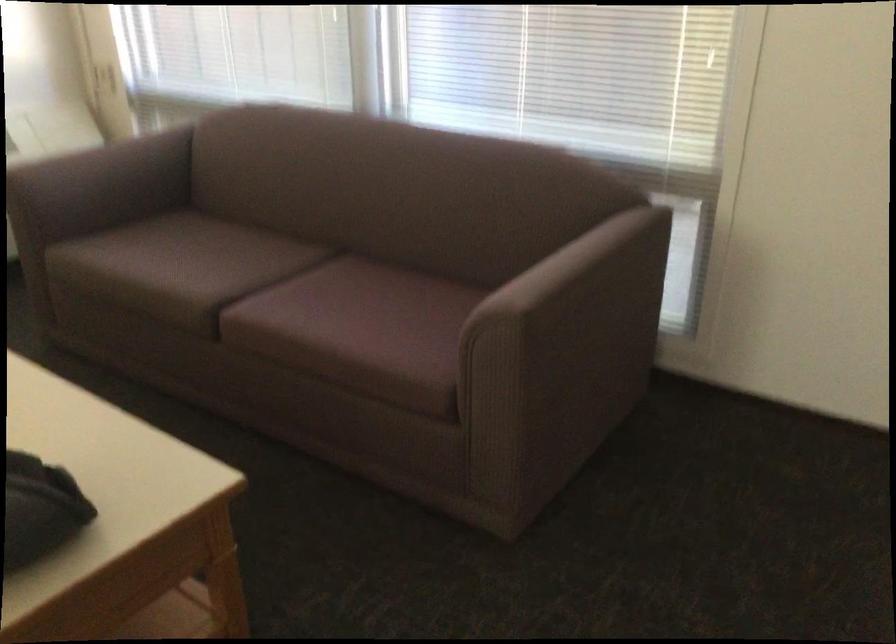
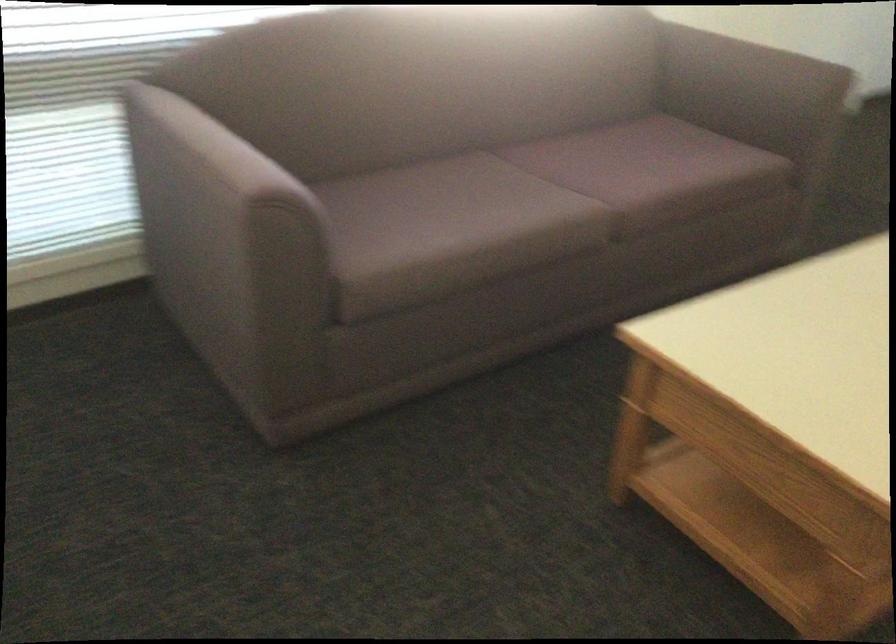
Where in the second image is the point corresponding to pixel 538 279 from the first image?

(746, 73)